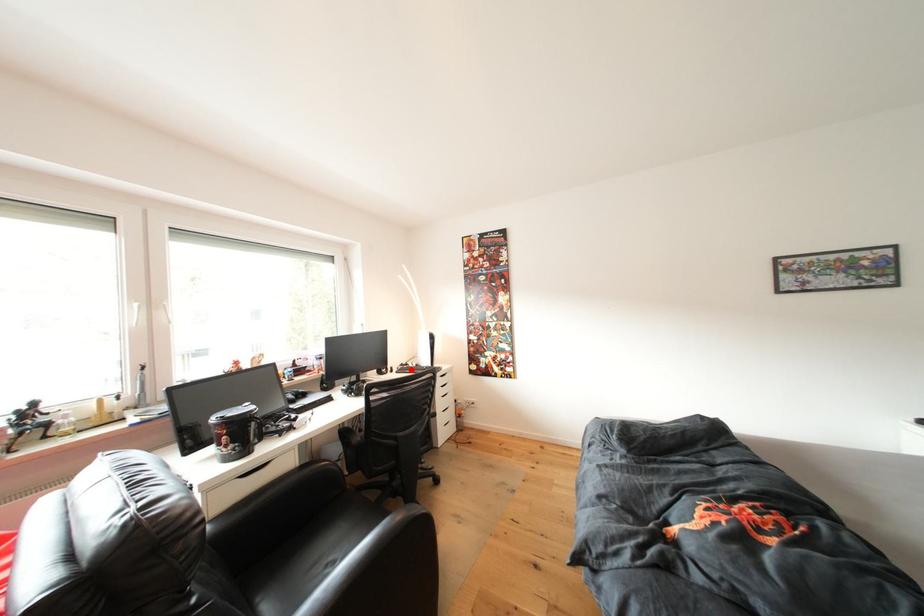
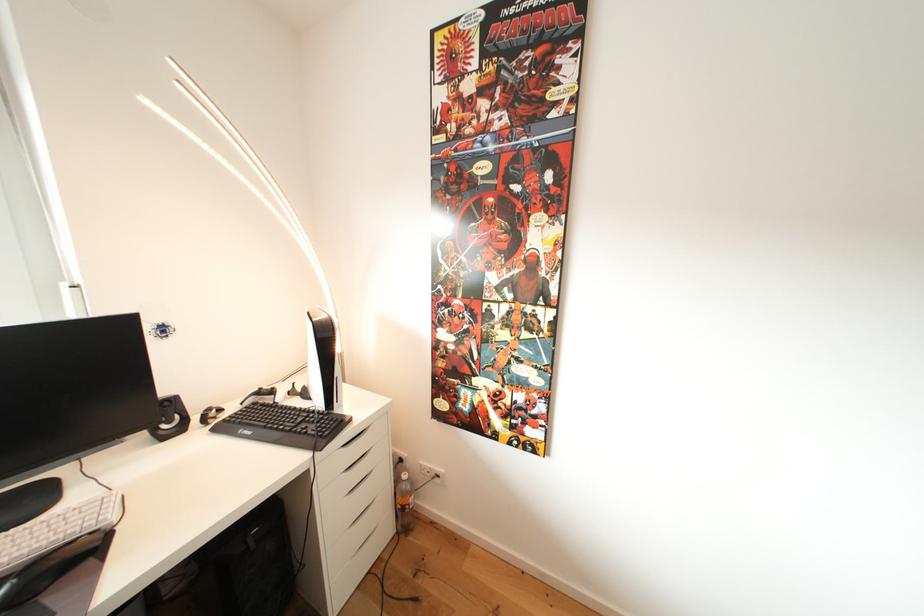
Where in the second image is the point corresponding to the highlighted location from the first image?

(268, 398)